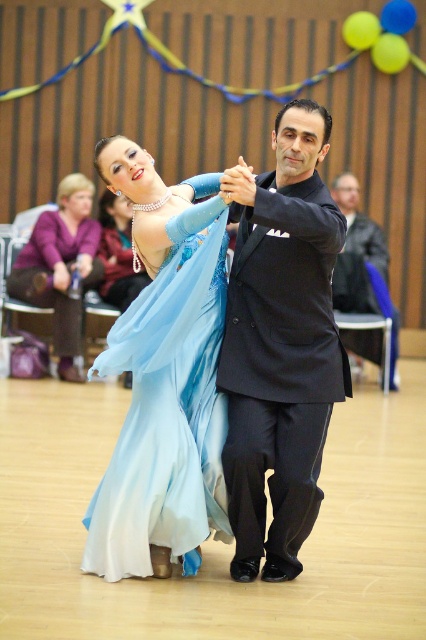
Question: Which point is farther from the camera taking this photo?

Choices:
 (A) (66, 292)
 (B) (334, 232)
 (C) (374, 244)
 (D) (210, 227)

Answer: (C)

Question: Which point is closer to the camera taking this photo?

Choices:
 (A) (149, 547)
 (B) (333, 321)
 (C) (348, 248)

Answer: (A)

Question: Does black satin suit at center have a greater width compared to light blue satin dress at center?

Choices:
 (A) no
 (B) yes

Answer: (A)

Question: Is light blue satin dress at center positioned behind matte purple dress at upper left?

Choices:
 (A) yes
 (B) no

Answer: (B)

Question: Is black satin suit at center below black smooth suit at center?

Choices:
 (A) no
 (B) yes

Answer: (B)

Question: Which point is closer to the camera?

Choices:
 (A) (63, 227)
 (B) (212, 308)

Answer: (B)